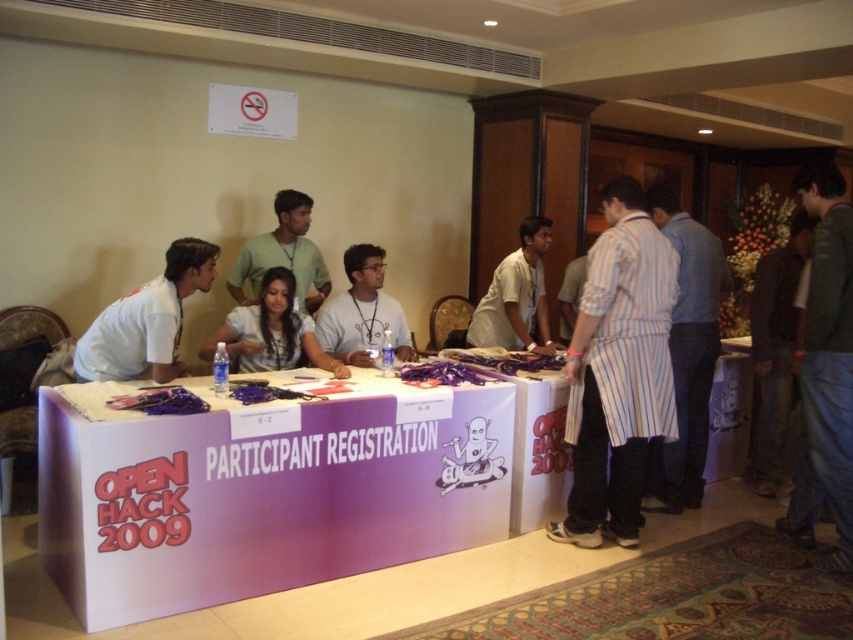
You are organizing the event and need to hang the dark brown leather jacket at right and the green cotton shirt at center on a rack. Which one requires a smaller hanger?

The dark brown leather jacket at right is thinner than the green cotton shirt at center, so it requires a smaller hanger.

You are a participant at the Open Hack 2009 event and need to pick up your registration materials. You see a dark brown leather jacket at right and a green cotton shirt at center. Which item should you approach first if you want to grab the larger item without moving too far from your current position?

The dark brown leather jacket at right is larger in size than the green cotton shirt at center, so you should approach the dark brown leather jacket at right first since it is already positioned to the right and requires less movement compared to the green cotton shirt at center.

You are standing at the registration table for the Open Hack 2009 event. There is a point marked at coordinates (x=576, y=529) on the table. If you want to place a name tag exactly at this point, how far in meters should you walk forward from your current position to reach that spot?

The point at (x=576, y=529) is 3.46 meters away from the viewer, so you should walk forward 3.46 meters to reach it.